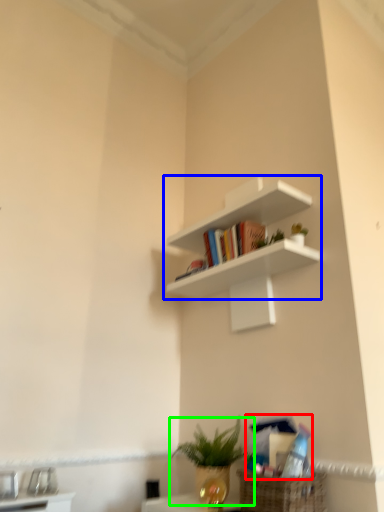
Question: Which object is positioned closest to book (highlighted by a red box)? Select from shelf (highlighted by a blue box) and houseplant (highlighted by a green box).

Choices:
 (A) shelf
 (B) houseplant

Answer: (B)